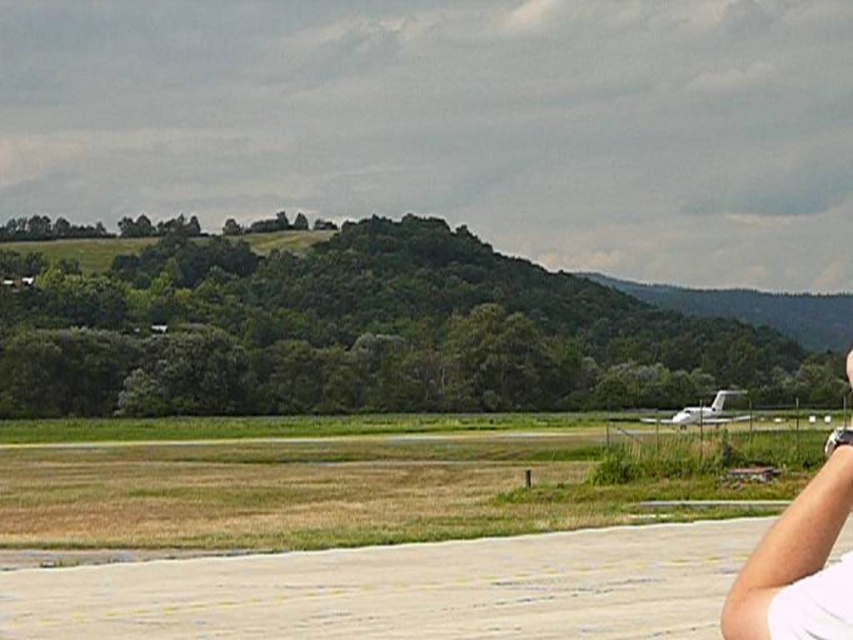
You are a drone operator trying to navigate between two points marked on the image. The first point is at point (776, 625) and the second point is at point (650, 422). Based on the scene, which point is closer to the airfield?

Point (776, 625) is in front of point (650, 422), so it is closer to the airfield.

You are a pilot preparing to land a small aircraft on the airfield. You see the white smooth tarmac at lower center and the white fabric at lower right. Which surface should you aim for to ensure a safe landing?

You should aim for the white smooth tarmac at lower center because it is located below the white fabric at lower right, making it the appropriate landing surface.